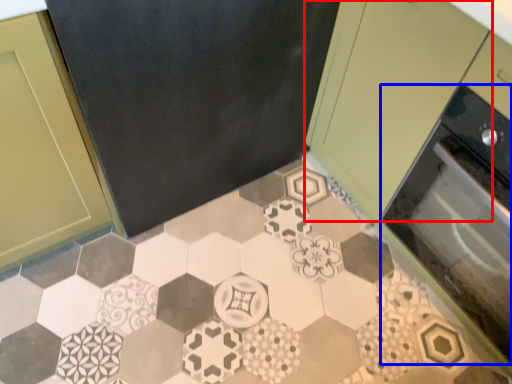
Question: Which point is closer to the camera, cabinetry (highlighted by a red box) or oven (highlighted by a blue box)?

Choices:
 (A) cabinetry
 (B) oven

Answer: (A)